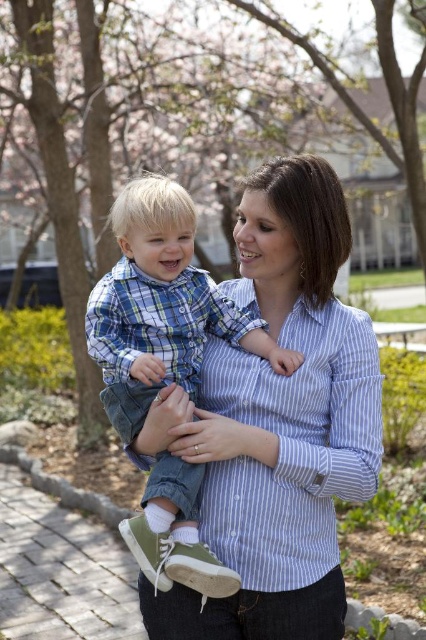
Between blue striped shirt at center and blue plaid shirt at center, which one has less height?

blue striped shirt at center is shorter.

Is blue striped shirt at center wider than blue plaid shirt at center?

Incorrect, blue striped shirt at center's width does not surpass blue plaid shirt at center's.

Is point (270, 584) behind point (129, 300)?

No, it is in front of (129, 300).

This screenshot has height=640, width=426. Identify the location of blue striped shirt at center. (293, 445).